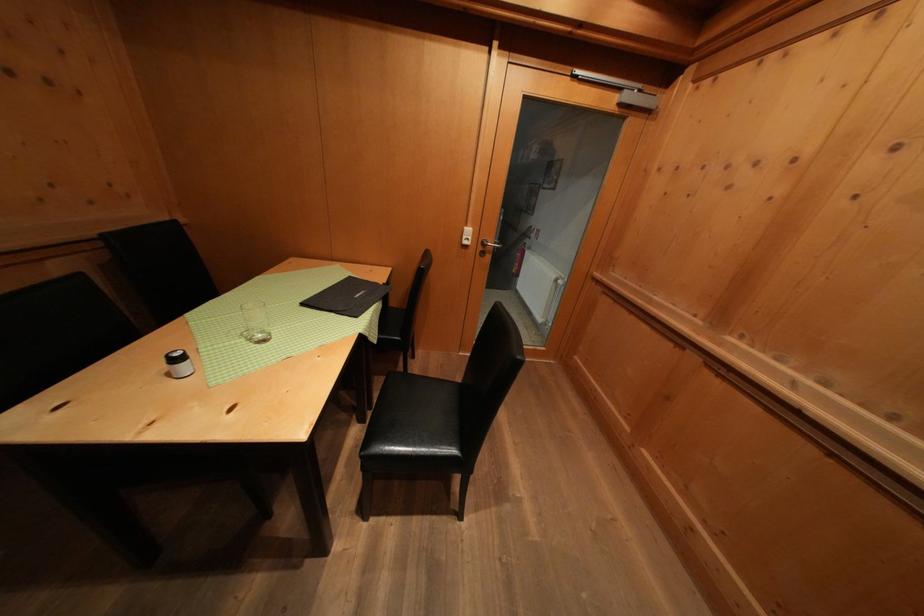
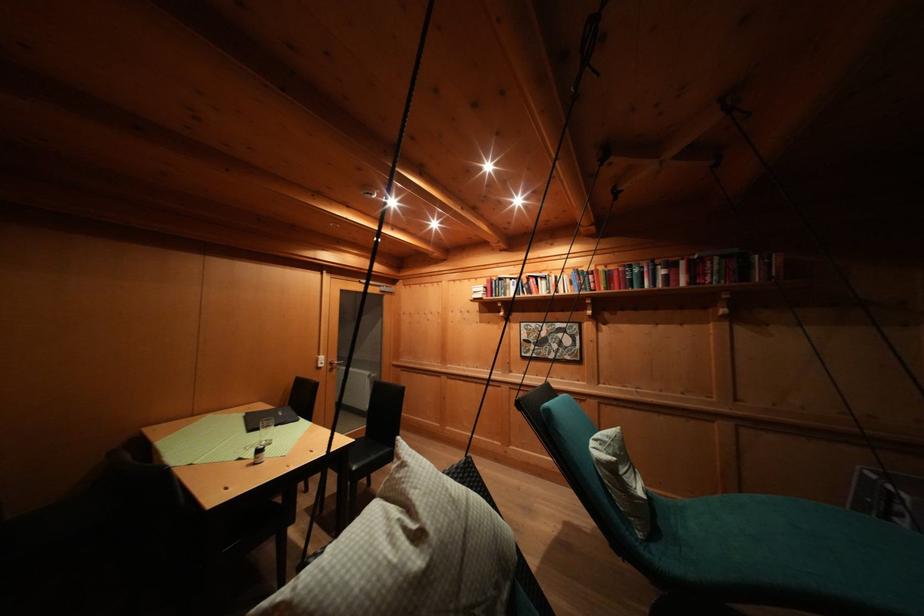
Where in the second image is the point corresponding to [475,235] from the first image?

(327, 362)